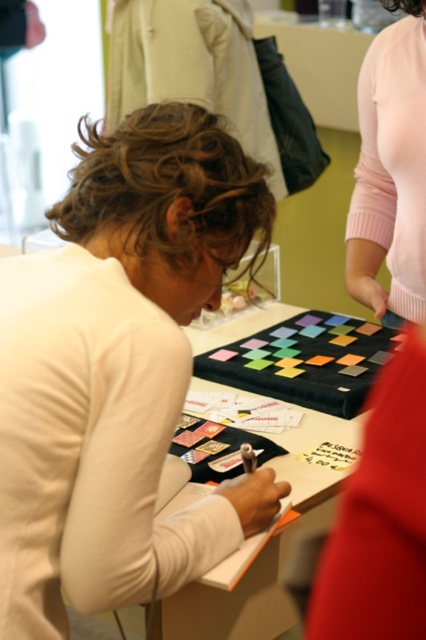
You are a fashion designer observing a workshop scene. You need to place a 25 inch wide decorative cloth between the matte white shirt at center and the pink sweater at upper right. Will there be enough space?

The distance between the matte white shirt at center and the pink sweater at upper right is 27.14 inches. Since the decorative cloth is 25 inches wide, there is enough space to place it between them.

You are organizing a clothing donation drive and need to decide which items to prioritize based on their material thickness. You have a pink sweater at upper right and a black fabric at center. Which item should you choose if you need a thicker material for winter donations?

The black fabric at center should be chosen because it is thicker than the pink sweater at upper right, making it more suitable for winter donations.

You are organizing a small event and need to place a 20 inch wide decorative item between the pink sweater at upper right and the black fabric at center. Can you fit it there?

The distance between the pink sweater at upper right and the black fabric at center is 22.15 inches. Since the decorative item is 20 inches wide, it can fit in the space between them as there is enough room.